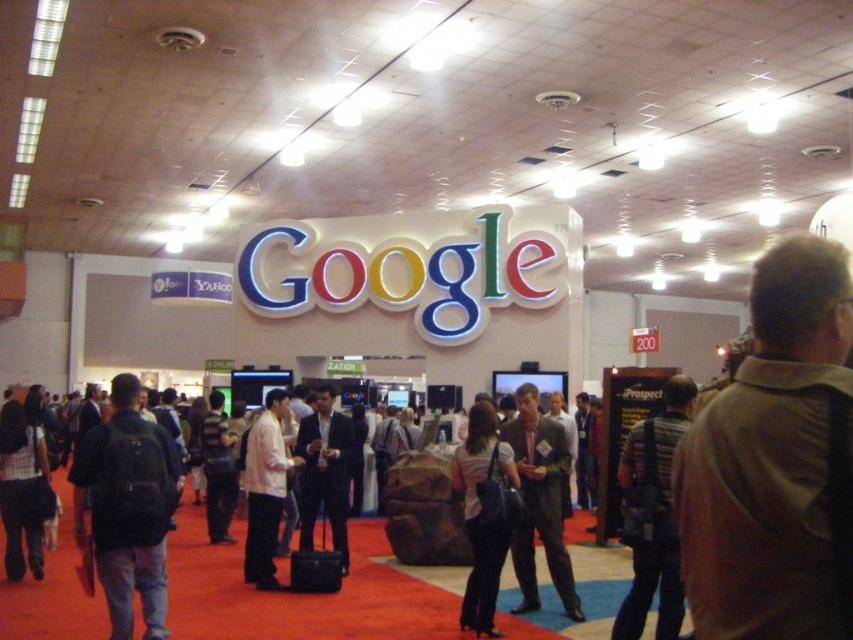
Question: Among these objects, which one is farthest from the camera?

Choices:
 (A) striped shirt at center
 (B) matte black shirt at center
 (C) dark gray suit at center

Answer: (C)

Question: Which object is positioned closest to the black suit at center?

Choices:
 (A) gray suit at center
 (B) black backpack at left
 (C) brown leather jacket at upper right

Answer: (A)

Question: Which object is positioned closest to the brown leather jacket at upper right?

Choices:
 (A) matte black shirt at center
 (B) white matte shirt at center
 (C) gray suit at center

Answer: (A)

Question: In this image, where is striped shirt at center located relative to white matte shirt at center?

Choices:
 (A) below
 (B) above

Answer: (A)

Question: In this image, where is plaid shirt at lower left located relative to white matte shirt at center?

Choices:
 (A) above
 (B) below

Answer: (B)

Question: Is plaid shirt at lower left thinner than white matte shirt at center?

Choices:
 (A) yes
 (B) no

Answer: (B)